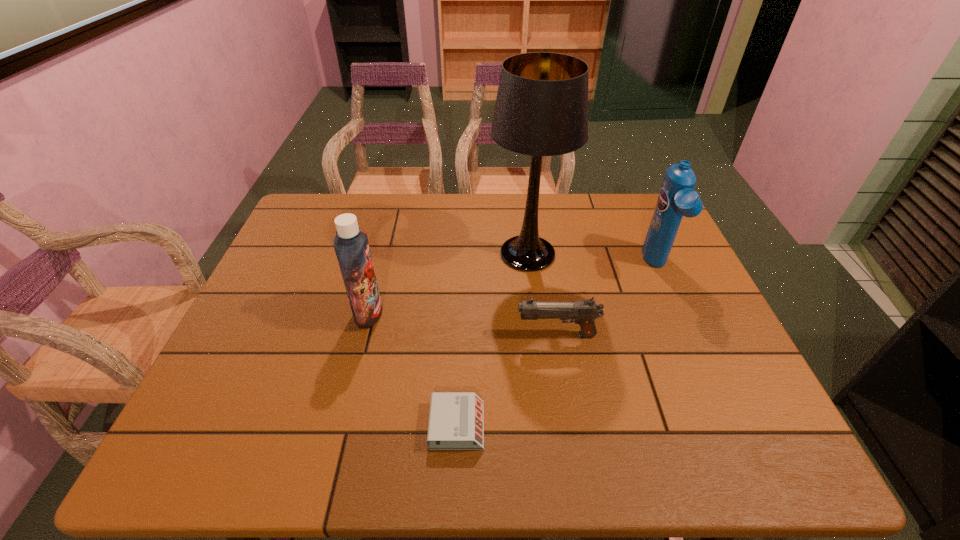
Where is `table lamp`? table lamp is located at coordinates (541, 109).

The image size is (960, 540). I want to click on the rightmost object, so click(x=676, y=199).

You are a GUI agent. You are given a task and a screenshot of the screen. Output one action in this format:
    pyautogui.click(x=<x>, y=<y>)
    Task: Click on the farther shampoo
    The height and width of the screenshot is (540, 960).
    Given the screenshot: What is the action you would take?
    pyautogui.click(x=676, y=199)

Identify the location of the nearer shampoo. This screenshot has height=540, width=960. (351, 245).

At what (x,y) coordinates should I click in order to perform the action: click on the leftmost object. Please return your answer as a coordinate pair (x, y). Looking at the image, I should click on (351, 245).

This screenshot has width=960, height=540. Identify the location of gun. (584, 312).

What are the coordinates of `the shortest object` in the screenshot? It's located at (456, 421).

Locate an element on the screen. Image resolution: width=960 pixels, height=540 pixels. the nearest object is located at coordinates (456, 421).

I want to click on free space located on the right of the tallest object, so click(659, 254).

What are the coordinates of `vacant area located on the back of the farther shampoo` in the screenshot? It's located at (636, 218).